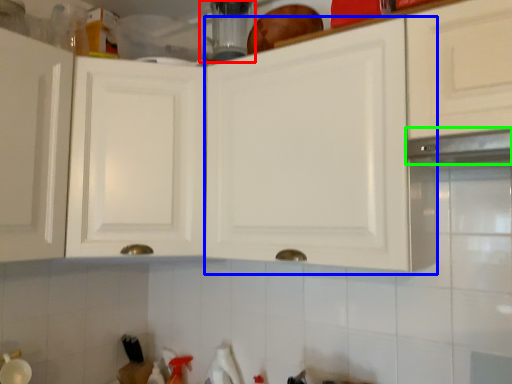
Question: Considering the real-world distances, which object is closest to appliance (highlighted by a red box)? cabinetry (highlighted by a blue box) or exhaust hood (highlighted by a green box).

Choices:
 (A) cabinetry
 (B) exhaust hood

Answer: (A)